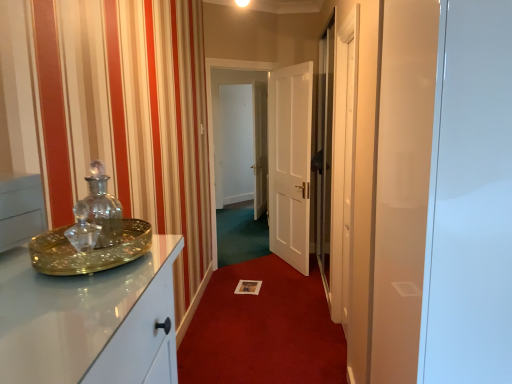
Where is `vacant space in front of transparent glass door at center, the second glass door in the right-to-left sequence`? The height and width of the screenshot is (384, 512). vacant space in front of transparent glass door at center, the second glass door in the right-to-left sequence is located at coordinates (243, 272).